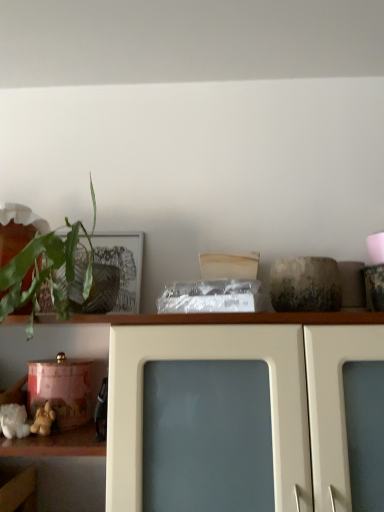
Question: Can you confirm if soft yellow plush toy at lower left is wider than green leafy plant at left?

Choices:
 (A) no
 (B) yes

Answer: (A)

Question: From a real-world perspective, does soft yellow plush toy at lower left stand above green leafy plant at left?

Choices:
 (A) no
 (B) yes

Answer: (A)

Question: Considering the relative sizes of soft yellow plush toy at lower left and green leafy plant at left in the image provided, is soft yellow plush toy at lower left bigger than green leafy plant at left?

Choices:
 (A) no
 (B) yes

Answer: (A)

Question: Does soft yellow plush toy at lower left have a lesser height compared to green leafy plant at left?

Choices:
 (A) no
 (B) yes

Answer: (B)

Question: Is soft yellow plush toy at lower left turned away from green leafy plant at left?

Choices:
 (A) no
 (B) yes

Answer: (A)

Question: Considering the positions of white glossy cabinet at upper center and soft yellow plush toy at lower left in the image, is white glossy cabinet at upper center bigger or smaller than soft yellow plush toy at lower left?

Choices:
 (A) small
 (B) big

Answer: (B)

Question: Which is correct: white glossy cabinet at upper center is inside soft yellow plush toy at lower left, or outside of it?

Choices:
 (A) inside
 (B) outside

Answer: (B)

Question: In terms of height, does white glossy cabinet at upper center look taller or shorter compared to soft yellow plush toy at lower left?

Choices:
 (A) short
 (B) tall

Answer: (B)

Question: Is point (14, 344) closer or farther from the camera than point (38, 415)?

Choices:
 (A) farther
 (B) closer

Answer: (A)

Question: Looking at their shapes, would you say white glossy cabinet at upper center is wider or thinner than green leafy plant at left?

Choices:
 (A) wide
 (B) thin

Answer: (A)

Question: From a real-world perspective, is white glossy cabinet at upper center above or below green leafy plant at left?

Choices:
 (A) above
 (B) below

Answer: (B)

Question: Would you say white glossy cabinet at upper center is inside or outside green leafy plant at left?

Choices:
 (A) outside
 (B) inside

Answer: (A)

Question: From their relative heights in the image, would you say white glossy cabinet at upper center is taller or shorter than green leafy plant at left?

Choices:
 (A) tall
 (B) short

Answer: (A)

Question: Looking at their shapes, would you say green leafy plant at left is wider or thinner than white glossy cabinet at upper center?

Choices:
 (A) thin
 (B) wide

Answer: (A)

Question: Is green leafy plant at left to the left or to the right of white glossy cabinet at upper center in the image?

Choices:
 (A) right
 (B) left

Answer: (B)